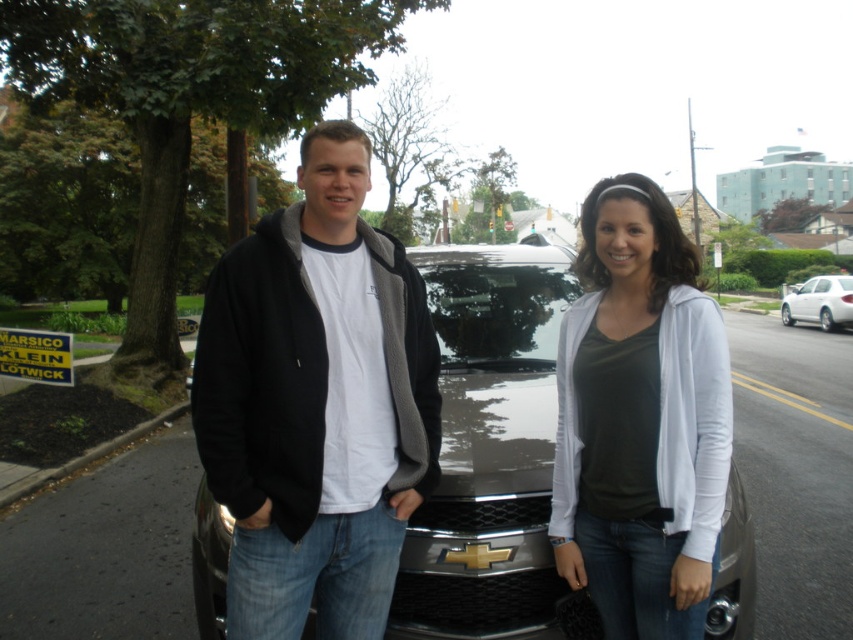
The width and height of the screenshot is (853, 640). What do you see at coordinates (316, 403) in the screenshot? I see `black fleece jacket at center` at bounding box center [316, 403].

Between black fleece jacket at center and white glossy sedan at center, which one is positioned higher?

white glossy sedan at center

From the picture: Measure the distance between black fleece jacket at center and camera.

A distance of 1.89 meters exists between black fleece jacket at center and camera.

The height and width of the screenshot is (640, 853). Identify the location of black fleece jacket at center. (316, 403).

Is white soft sweater at center below glossy metallic car at center?

Actually, white soft sweater at center is above glossy metallic car at center.

Is point (669, 356) more distant than point (431, 522)?

No, it is in front of (431, 522).

You are a GUI agent. You are given a task and a screenshot of the screen. Output one action in this format:
    pyautogui.click(x=<x>, y=<y>)
    Task: Click on the white soft sweater at center
    Image resolution: width=853 pixels, height=640 pixels.
    Given the screenshot: What is the action you would take?
    pyautogui.click(x=640, y=420)

Locate an element on the screen. Image resolution: width=853 pixels, height=640 pixels. white soft sweater at center is located at coordinates (640, 420).

Between white soft sweater at center and white glossy sedan at center, which one is positioned higher?

white glossy sedan at center is above.

Between point (610, 438) and point (782, 307), which one is positioned behind?

Positioned behind is point (782, 307).

At what (x,y) coordinates should I click in order to perform the action: click on white soft sweater at center. Please return your answer as a coordinate pair (x, y). Looking at the image, I should click on (640, 420).